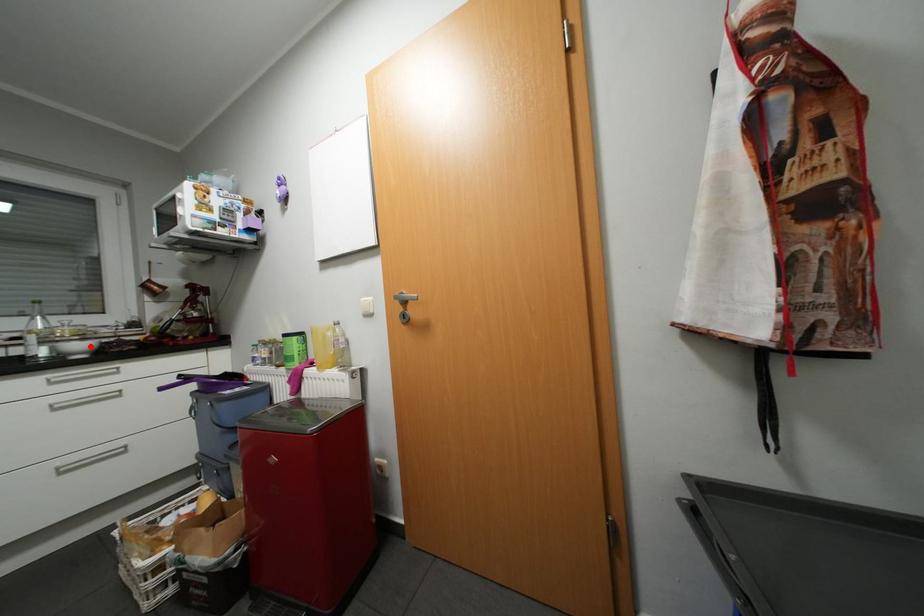
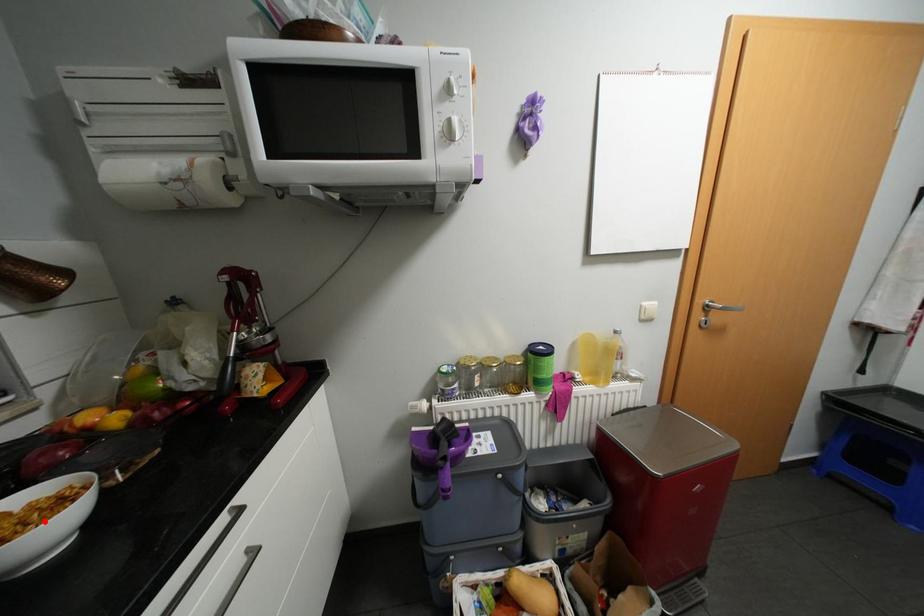
I am providing you with two images of the same scene from different viewpoints. A red point is marked on the first image and another point is marked on the second image. Is the marked point in image1 the same physical position as the marked point in image2?

Yes